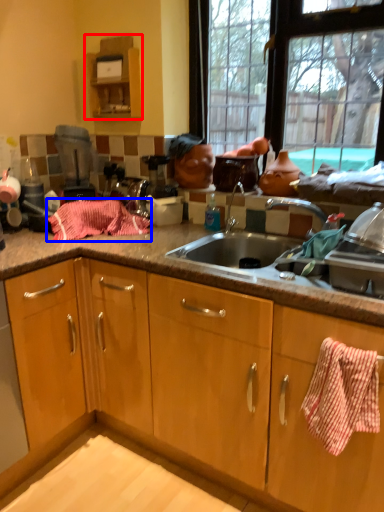
Question: Which object appears closest to the camera in this image, cabinetry (highlighted by a red box) or blanket (highlighted by a blue box)?

Choices:
 (A) cabinetry
 (B) blanket

Answer: (B)